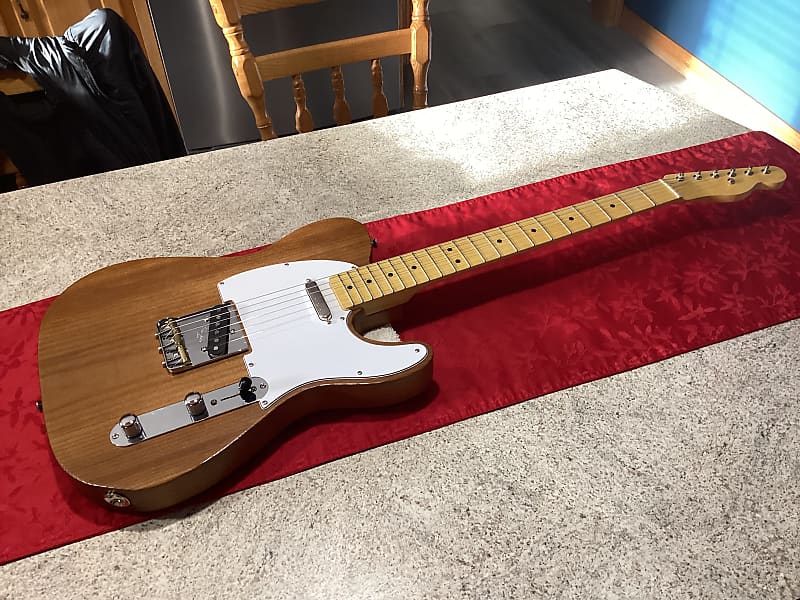
Find the location of `walll`. walll is located at coordinates (761, 48).